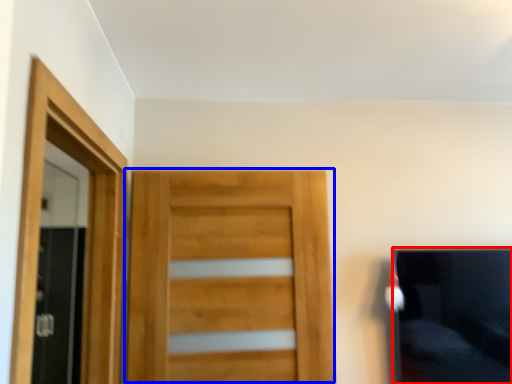
Question: Which of the following is the farthest to the observer, couch (highlighted by a red box) or door (highlighted by a blue box)?

Choices:
 (A) couch
 (B) door

Answer: (A)